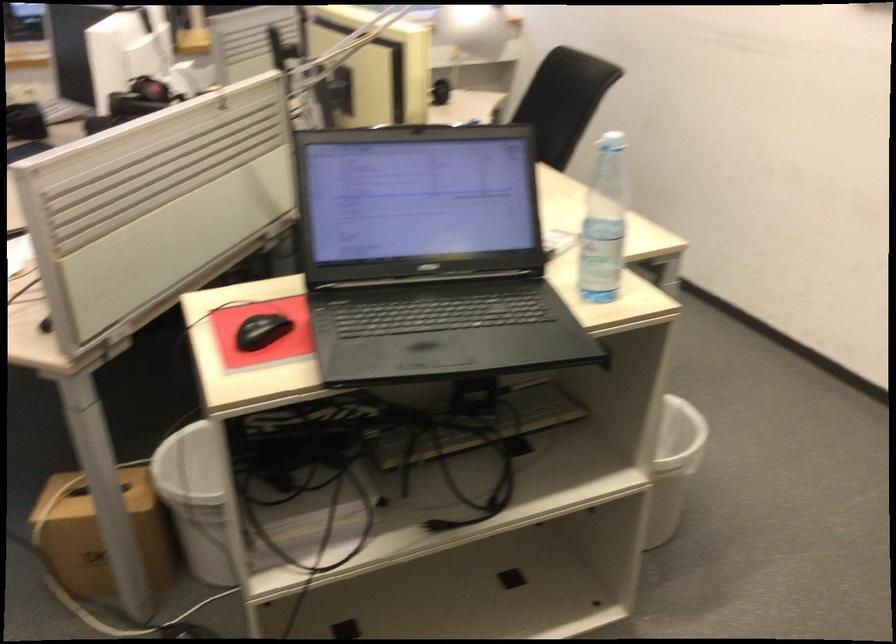
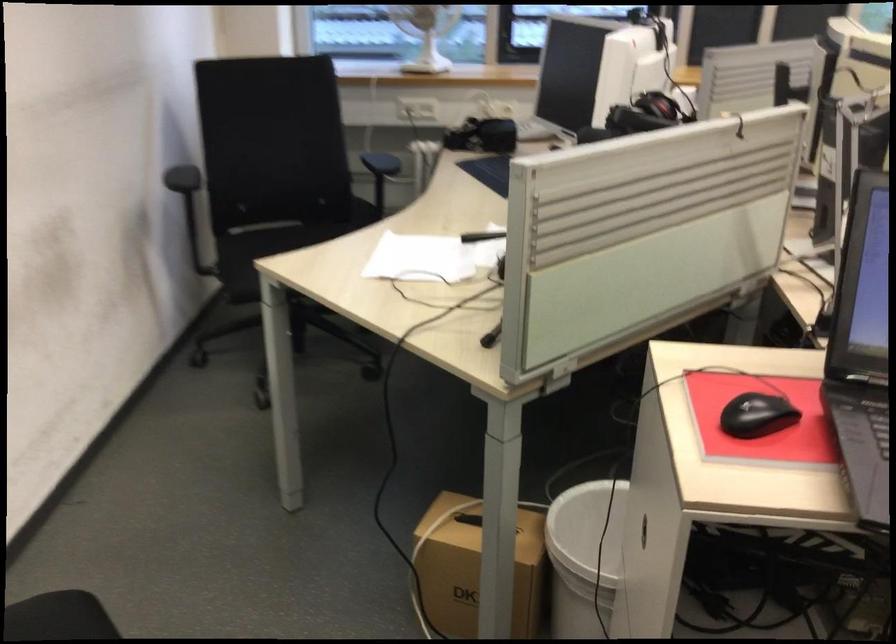
The point at (255, 333) is marked in the first image. Where is the corresponding point in the second image?

(756, 415)